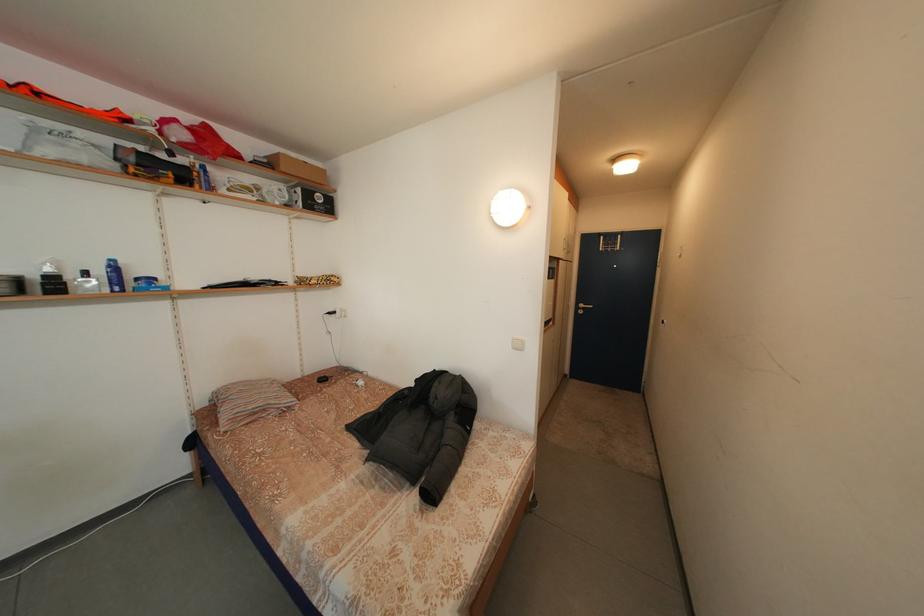
This screenshot has width=924, height=616. Find the location of `perfume bottle sprayer`. perfume bottle sprayer is located at coordinates (114, 276).